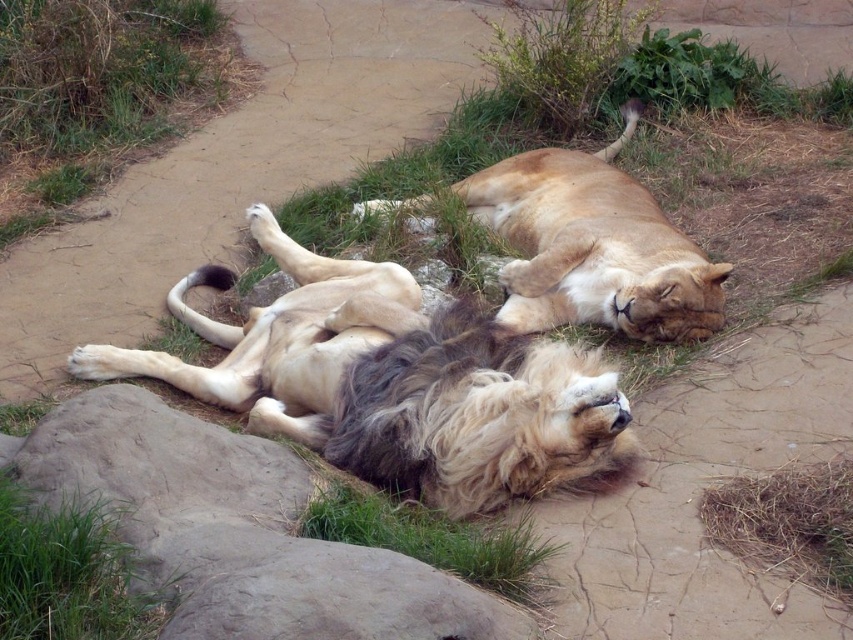
Between green grass at upper left and golden fur lion at upper center, which one has more height?

green grass at upper left

Between green grass at upper left and golden fur lion at upper center, which one is positioned higher?

green grass at upper left is above.

At what (x,y) coordinates should I click in order to perform the action: click on green grass at upper left. Please return your answer as a coordinate pair (x, y). This screenshot has width=853, height=640. Looking at the image, I should click on (102, 93).

Does point (445, 385) lie in front of point (636, 225)?

Yes, point (445, 385) is closer to viewer.

Between golden fur lion at center and golden fur lion at upper center, which one appears on the left side from the viewer's perspective?

From the viewer's perspective, golden fur lion at center appears more on the left side.

Find the location of a particular element. golden fur lion at center is located at coordinates (395, 384).

Can you confirm if golden fur lion at center is positioned above gray rock at lower left?

Correct, golden fur lion at center is located above gray rock at lower left.

Is golden fur lion at center positioned in front of gray rock at lower left?

That is False.

Is point (578, 349) farther from camera compared to point (167, 621)?

Yes, point (578, 349) is farther from viewer.

Image resolution: width=853 pixels, height=640 pixels. I want to click on golden fur lion at center, so click(395, 384).